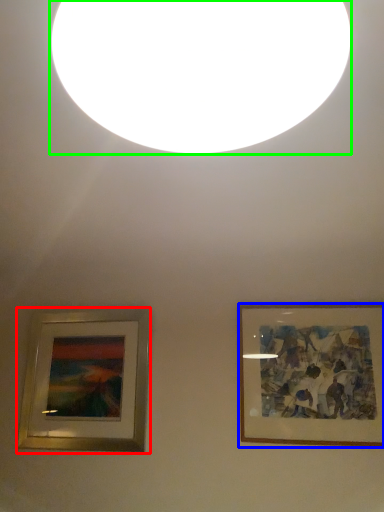
Question: Based on their relative distances, which object is nearer to picture frame (highlighted by a red box)? Choose from picture frame (highlighted by a blue box) and lighting (highlighted by a green box).

Choices:
 (A) picture frame
 (B) lighting

Answer: (A)